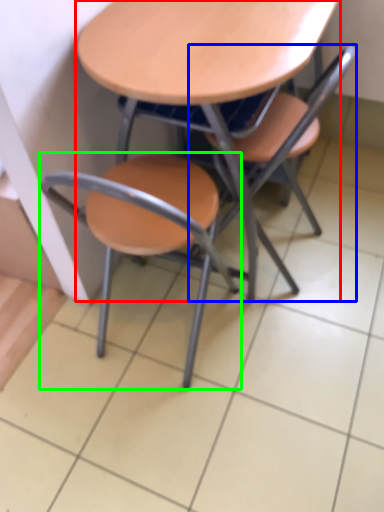
Question: Based on their relative distances, which object is nearer to table (highlighted by a red box)? Choose from chair (highlighted by a blue box) and chair (highlighted by a green box).

Choices:
 (A) chair
 (B) chair

Answer: (A)